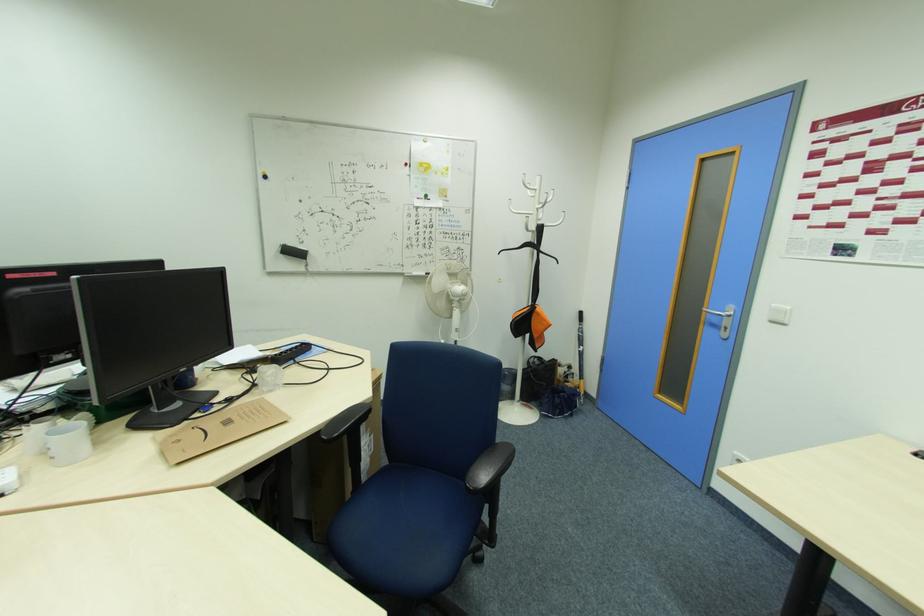
Where would you lift the white mug? Please return your answer as a coordinate pair (x, y).

(67, 443)